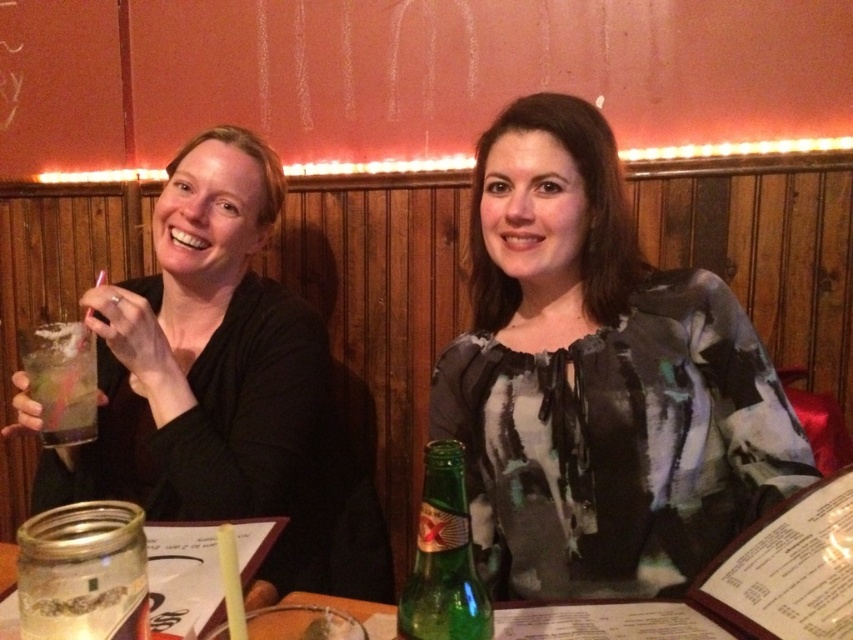
You are a photographer setting up for a group photo. You notice the matte black shirt at left and the green glass bottle at center in your frame. Based on their sizes, which object should you focus on to ensure both are clearly visible in the photo?

The matte black shirt at left is bigger than the green glass bottle at center, so focusing on the matte black shirt at left would ensure both are clearly visible as it occupies more space in the frame.

You are a photographer setting up for a group photo. You notice the matte black shirt at left and the clear plastic cup at left in the scene. Which object is wider when viewed from your position?

The matte black shirt at left is wider than the clear plastic cup at left, so the matte black shirt at left is wider.